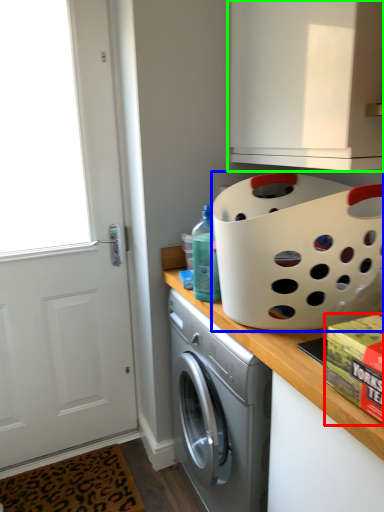
Question: Estimate the real-world distances between objects in this image. Which object is closer to box (highlighted by a red box), basket (highlighted by a blue box) or cabinetry (highlighted by a green box)?

Choices:
 (A) basket
 (B) cabinetry

Answer: (A)